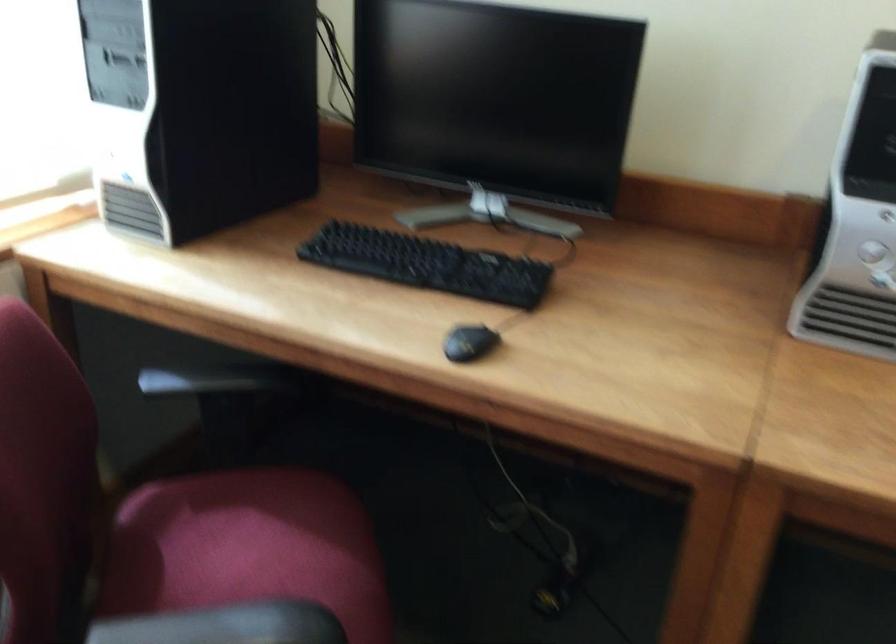
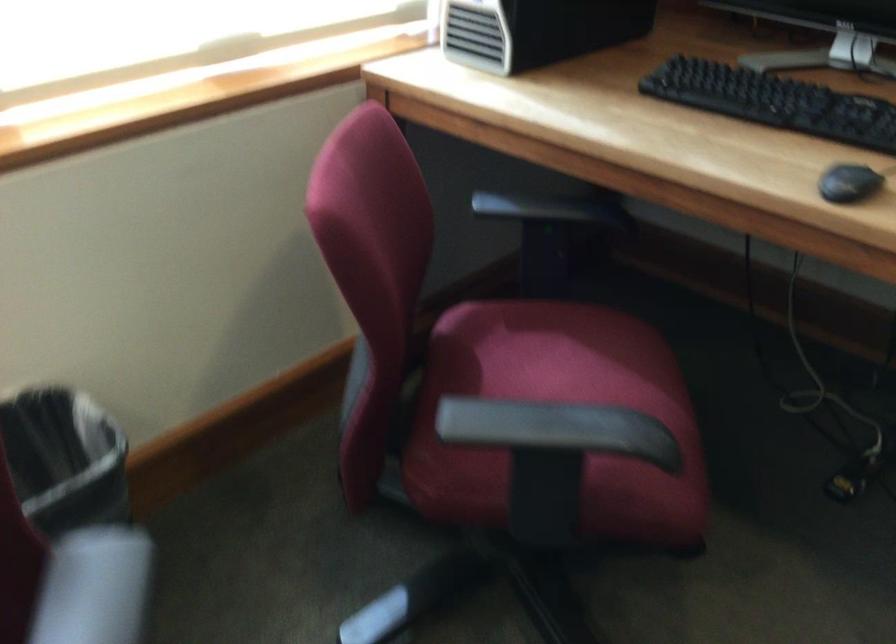
Find the pixel in the second image that matches (x=470, y=351) in the first image.

(848, 183)